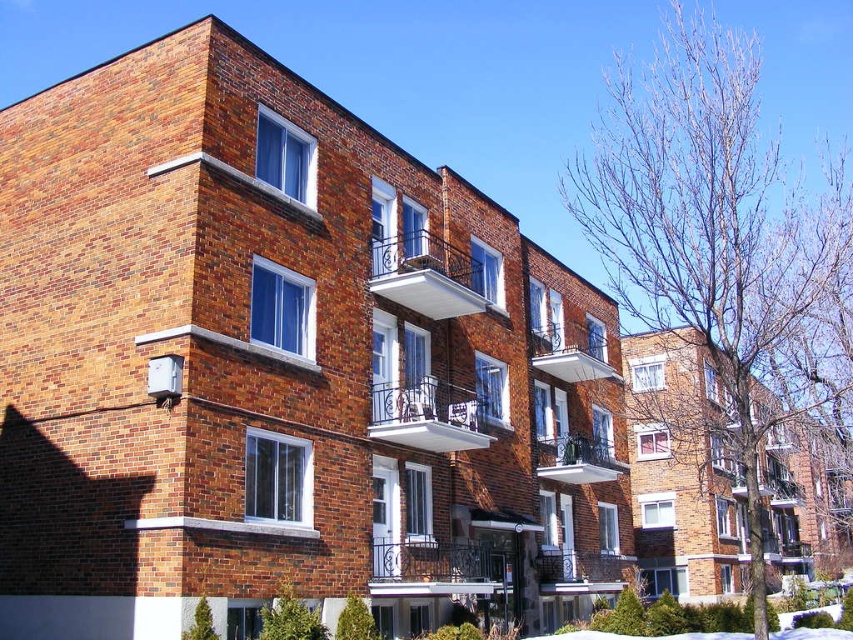
Can you confirm if black wrought iron balcony at center is bigger than rustic wrought iron balcony at center?

Incorrect, black wrought iron balcony at center is not larger than rustic wrought iron balcony at center.

Who is positioned more to the right, black wrought iron balcony at center or rustic wrought iron balcony at center?

rustic wrought iron balcony at center

The image size is (853, 640). I want to click on black wrought iron balcony at center, so click(426, 275).

Where is `black wrought iron balcony at center`? black wrought iron balcony at center is located at coordinates (426, 275).

Who is more forward, (613, 586) or (554, 468)?

Point (554, 468) is more forward.

Is smooth metal balcony at center shorter than metallic silver balcony at center?

In fact, smooth metal balcony at center may be taller than metallic silver balcony at center.

Which is behind, point (601, 586) or point (569, 456)?

The point (569, 456) is more distant.

Where is `smooth metal balcony at center`? smooth metal balcony at center is located at coordinates (582, 572).

Can you confirm if black wrought iron balcony at center is shorter than smooth metal balcony at center?

Yes.

Who is more distant from viewer, (432, 301) or (610, 588)?

Point (610, 588)

Is point (431, 292) positioned before point (537, 564)?

That is True.

Locate an element on the screen. This screenshot has width=853, height=640. black wrought iron balcony at center is located at coordinates (426, 275).